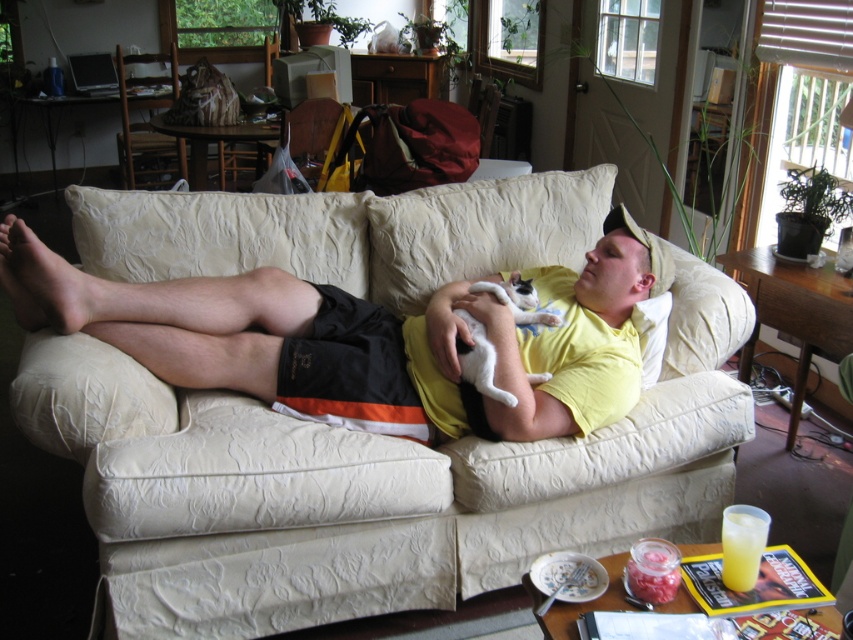
Question: Among these objects, which one is farthest from the camera?

Choices:
 (A) yellow matte shirt at center
 (B) white fur cat at center
 (C) yellow translucent cup at lower right

Answer: (A)

Question: Is beige fabric couch at center to the left of yellow translucent cup at lower right from the viewer's perspective?

Choices:
 (A) no
 (B) yes

Answer: (B)

Question: Which of the following is the closest to the observer?

Choices:
 (A) beige fabric couch at center
 (B) white fur cat at center
 (C) yellow cotton shirt at center

Answer: (A)

Question: In this image, where is yellow cotton shirt at center located relative to white fur cat at center?

Choices:
 (A) below
 (B) above

Answer: (B)

Question: Which object appears closest to the camera in this image?

Choices:
 (A) white fur cat at center
 (B) yellow matte shirt at center
 (C) yellow translucent cup at lower right
 (D) yellow cotton shirt at center

Answer: (C)

Question: Does beige fabric couch at center have a smaller size compared to yellow cotton shirt at center?

Choices:
 (A) yes
 (B) no

Answer: (B)